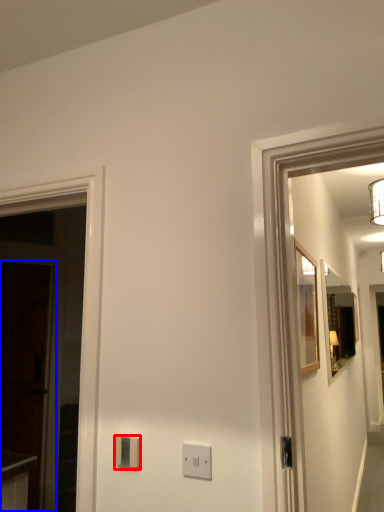
Question: Among these objects, which one is nearest to the camera, light switch (highlighted by a red box) or glass door (highlighted by a blue box)?

Choices:
 (A) light switch
 (B) glass door

Answer: (A)